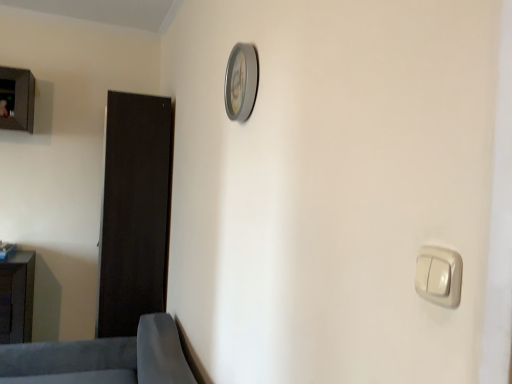
Image resolution: width=512 pixels, height=384 pixels. What do you see at coordinates (102, 358) in the screenshot?
I see `soft gray fabric sofa at lower left, arranged as the second furniture when viewed from the left` at bounding box center [102, 358].

You are a GUI agent. You are given a task and a screenshot of the screen. Output one action in this format:
    pyautogui.click(x=<x>, y=<y>)
    Task: Click on the soft gray fabric sofa at lower left, arranged as the second furniture when viewed from the left
    The image size is (512, 384).
    Given the screenshot: What is the action you would take?
    pyautogui.click(x=102, y=358)

What do you see at coordinates (439, 276) in the screenshot?
I see `white glossy light switch at lower right` at bounding box center [439, 276].

What are the coordinates of `matte black cabinet at lower left, which is counted as the second furniture, starting from the front` in the screenshot? It's located at (17, 298).

Could you tell me if dark wood door at left is facing white glossy light switch at lower right?

No, dark wood door at left is not aimed at white glossy light switch at lower right.

Does point (95, 332) lie behind point (432, 289)?

Yes, point (95, 332) is farther from viewer.

From the image's perspective, which object appears higher, dark wood door at left or white glossy light switch at lower right?

white glossy light switch at lower right.

Is dark wood door at left far away from white glossy light switch at lower right?

Yes.

Consider the image. Is matte black cabinet at lower left, placed as the first furniture when sorted from left to right, thinner than soft gray fabric sofa at lower left, the first furniture viewed from the right?

Yes, matte black cabinet at lower left, placed as the first furniture when sorted from left to right, is thinner than soft gray fabric sofa at lower left, the first furniture viewed from the right.

From the image's perspective, is matte black cabinet at lower left, acting as the first furniture starting from the back, below soft gray fabric sofa at lower left, which appears as the 2th furniture when viewed from the back?

Actually, matte black cabinet at lower left, acting as the first furniture starting from the back, appears above soft gray fabric sofa at lower left, which appears as the 2th furniture when viewed from the back, in the image.

Between matte black cabinet at lower left, the second furniture when ordered from right to left, and soft gray fabric sofa at lower left, which appears as the 2th furniture when viewed from the back, which one appears on the left side from the viewer's perspective?

Positioned to the left is matte black cabinet at lower left, the second furniture when ordered from right to left.

Image resolution: width=512 pixels, height=384 pixels. I want to click on door positioned vertically above the soft gray fabric sofa at lower left, which appears as the 2th furniture when viewed from the back (from a real-world perspective), so click(x=134, y=211).

Is soft gray fabric sofa at lower left, which appears as the 2th furniture when viewed from the back, turned away from dark wood door at left?

No, dark wood door at left is not at the back of soft gray fabric sofa at lower left, which appears as the 2th furniture when viewed from the back.

Is soft gray fabric sofa at lower left, arranged as the second furniture when viewed from the left, surrounding dark wood door at left?

Actually, dark wood door at left is outside soft gray fabric sofa at lower left, arranged as the second furniture when viewed from the left.

Can you confirm if soft gray fabric sofa at lower left, which appears as the 2th furniture when viewed from the back, is thinner than dark wood door at left?

In fact, soft gray fabric sofa at lower left, which appears as the 2th furniture when viewed from the back, might be wider than dark wood door at left.

You are a GUI agent. You are given a task and a screenshot of the screen. Output one action in this format:
    pyautogui.click(x=<x>, y=<y>)
    Task: Click on the 2nd furniture behind the white glossy light switch at lower right
    The width and height of the screenshot is (512, 384).
    Given the screenshot: What is the action you would take?
    pyautogui.click(x=17, y=298)

Does point (447, 288) lie behind point (18, 262)?

No, it is in front of (18, 262).

Between white glossy light switch at lower right and matte black cabinet at lower left, acting as the first furniture starting from the back, which one has larger width?

Wider between the two is matte black cabinet at lower left, acting as the first furniture starting from the back.

Who is shorter, white glossy light switch at lower right or matte black cabinet at lower left, placed as the first furniture when sorted from left to right?

white glossy light switch at lower right.

This screenshot has height=384, width=512. I want to click on light switch that appears above the soft gray fabric sofa at lower left, which appears as the 2th furniture when viewed from the back (from the image's perspective), so click(x=439, y=276).

Is point (435, 283) farther from viewer compared to point (49, 370)?

No, it is in front of (49, 370).

From a real-world perspective, is white glossy light switch at lower right physically above soft gray fabric sofa at lower left, arranged as the second furniture when viewed from the left?

Yes.

Is white glossy light switch at lower right turned away from soft gray fabric sofa at lower left, arranged as the second furniture when viewed from the left?

That's not correct — white glossy light switch at lower right is not looking away from soft gray fabric sofa at lower left, arranged as the second furniture when viewed from the left.

Is matte black cabinet at lower left, which is counted as the second furniture, starting from the front, situated inside dark wood door at left or outside?

matte black cabinet at lower left, which is counted as the second furniture, starting from the front, is located beyond the bounds of dark wood door at left.

Is point (10, 284) positioned behind point (119, 175)?

No, it is in front of (119, 175).

Can you confirm if matte black cabinet at lower left, which is counted as the second furniture, starting from the front, is smaller than dark wood door at left?

Correct, matte black cabinet at lower left, which is counted as the second furniture, starting from the front, occupies less space than dark wood door at left.

Considering the sizes of matte black cabinet at lower left, which is counted as the second furniture, starting from the front, and dark wood door at left in the image, is matte black cabinet at lower left, which is counted as the second furniture, starting from the front, wider or thinner than dark wood door at left?

In the image, matte black cabinet at lower left, which is counted as the second furniture, starting from the front, appears to be wider than dark wood door at left.

Is dark wood door at left not near matte black cabinet at lower left, placed as the first furniture when sorted from left to right?

Actually, dark wood door at left and matte black cabinet at lower left, placed as the first furniture when sorted from left to right, are a little close together.

Considering the relative sizes of dark wood door at left and matte black cabinet at lower left, the second furniture when ordered from right to left, in the image provided, is dark wood door at left bigger than matte black cabinet at lower left, the second furniture when ordered from right to left,?

Yes.

Who is shorter, dark wood door at left or matte black cabinet at lower left, the second furniture when ordered from right to left?

matte black cabinet at lower left, the second furniture when ordered from right to left.

Which object is closer to the camera taking this photo, dark wood door at left or matte black cabinet at lower left, placed as the first furniture when sorted from left to right?

Positioned in front is matte black cabinet at lower left, placed as the first furniture when sorted from left to right.

The height and width of the screenshot is (384, 512). What are the coordinates of `door on the left side of white glossy light switch at lower right` in the screenshot? It's located at (134, 211).

This screenshot has height=384, width=512. Identify the location of furniture below the matte black cabinet at lower left, acting as the first furniture starting from the back (from the image's perspective). (102, 358).

Considering their positions, is soft gray fabric sofa at lower left, arranged as the second furniture when viewed from the left, positioned further to matte black cabinet at lower left, placed as the first furniture when sorted from left to right, than silver metallic clock at upper center?

silver metallic clock at upper center is positioned further to the anchor matte black cabinet at lower left, placed as the first furniture when sorted from left to right.

When comparing their distances from silver metallic clock at upper center, does dark wood door at left or soft gray fabric sofa at lower left, the first furniture viewed from the right, seem further?

Based on the image, soft gray fabric sofa at lower left, the first furniture viewed from the right, appears to be further to silver metallic clock at upper center.

Based on their spatial positions, is matte black cabinet at lower left, the second furniture when ordered from right to left, or dark wood door at left closer to soft gray fabric sofa at lower left, the first furniture viewed from the right?

matte black cabinet at lower left, the second furniture when ordered from right to left, is positioned closer to the anchor soft gray fabric sofa at lower left, the first furniture viewed from the right.

Looking at the image, which one is located closer to soft gray fabric sofa at lower left, which ranks as the 1th furniture in front-to-back order, white glossy light switch at lower right or matte black cabinet at lower left, which is counted as the second furniture, starting from the front?

matte black cabinet at lower left, which is counted as the second furniture, starting from the front, lies closer to soft gray fabric sofa at lower left, which ranks as the 1th furniture in front-to-back order, than the other object.

Considering their positions, is matte black cabinet at lower left, acting as the first furniture starting from the back, positioned closer to silver metallic clock at upper center than dark wood door at left?

The object closer to silver metallic clock at upper center is dark wood door at left.

When comparing their distances from soft gray fabric sofa at lower left, the first furniture viewed from the right, does dark wood door at left or matte black cabinet at lower left, the second furniture when ordered from right to left, seem further?

dark wood door at left is positioned further to the anchor soft gray fabric sofa at lower left, the first furniture viewed from the right.

When comparing their distances from soft gray fabric sofa at lower left, the first furniture viewed from the right, does dark wood door at left or silver metallic clock at upper center seem closer?

dark wood door at left is positioned closer to the anchor soft gray fabric sofa at lower left, the first furniture viewed from the right.

Estimate the real-world distances between objects in this image. Which object is further from matte black cabinet at lower left, placed as the first furniture when sorted from left to right, silver metallic clock at upper center or white glossy light switch at lower right?

white glossy light switch at lower right is further to matte black cabinet at lower left, placed as the first furniture when sorted from left to right.

Where is `clock between soft gray fabric sofa at lower left, which ranks as the 1th furniture in front-to-back order, and dark wood door at left in the front-back direction`? clock between soft gray fabric sofa at lower left, which ranks as the 1th furniture in front-to-back order, and dark wood door at left in the front-back direction is located at coordinates (241, 82).

This screenshot has width=512, height=384. I want to click on furniture between matte black cabinet at lower left, placed as the first furniture when sorted from left to right, and silver metallic clock at upper center, in the horizontal direction, so click(102, 358).

You are a GUI agent. You are given a task and a screenshot of the screen. Output one action in this format:
    pyautogui.click(x=<x>, y=<y>)
    Task: Click on the clock between matte black cabinet at lower left, acting as the first furniture starting from the back, and white glossy light switch at lower right
    
    Given the screenshot: What is the action you would take?
    pyautogui.click(x=241, y=82)

Locate an element on the screen. This screenshot has height=384, width=512. furniture between white glossy light switch at lower right and matte black cabinet at lower left, placed as the first furniture when sorted from left to right, in the front-back direction is located at coordinates click(x=102, y=358).